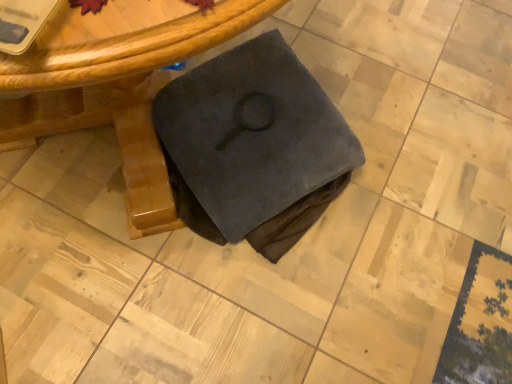
The height and width of the screenshot is (384, 512). I want to click on vacant space to the right of wooden table at center, so click(x=402, y=156).